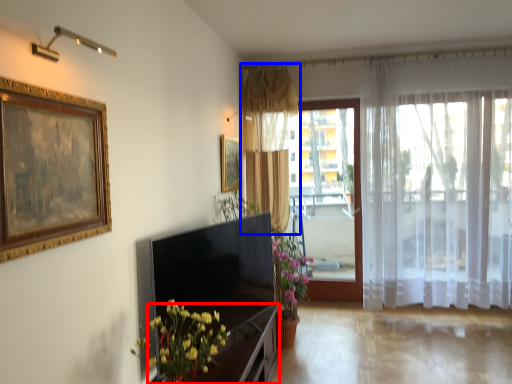
Question: Among these objects, which one is farthest to the camera, dresser (highlighted by a red box) or curtain (highlighted by a blue box)?

Choices:
 (A) dresser
 (B) curtain

Answer: (B)